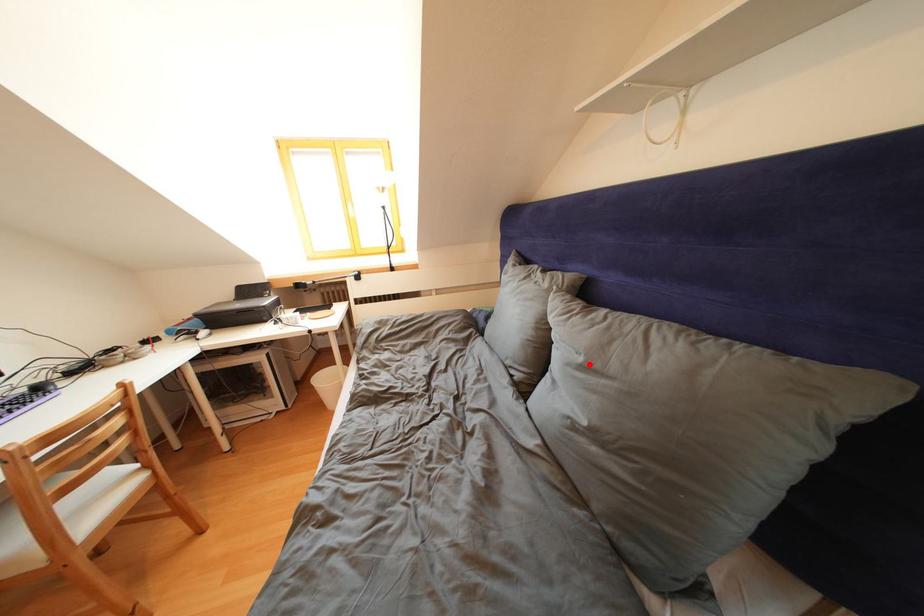
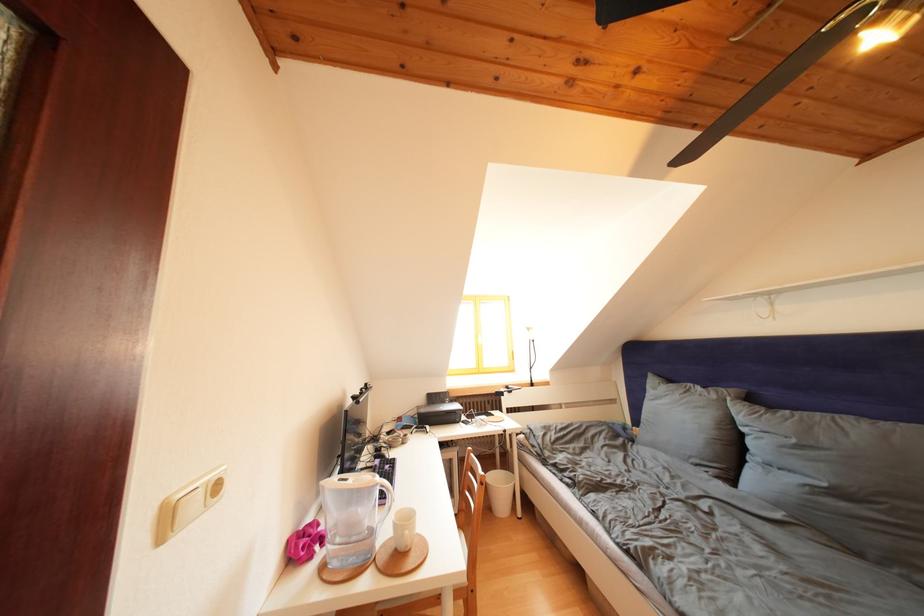
Find the pixel in the second image that matches the highlighted location in the first image.

(801, 446)